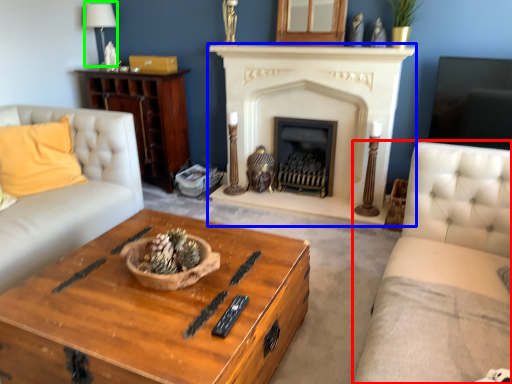
Question: Based on their relative distances, which object is farther from studio couch (highlighted by a red box)? Choose from fireplace (highlighted by a blue box) and lamp (highlighted by a green box).

Choices:
 (A) fireplace
 (B) lamp

Answer: (B)